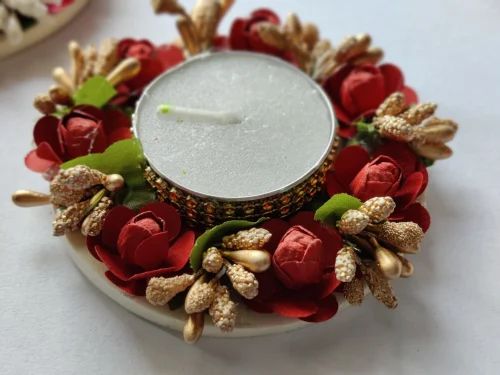
Where is `space to the far right corner of table`? The image size is (500, 375). space to the far right corner of table is located at coordinates (471, 24).